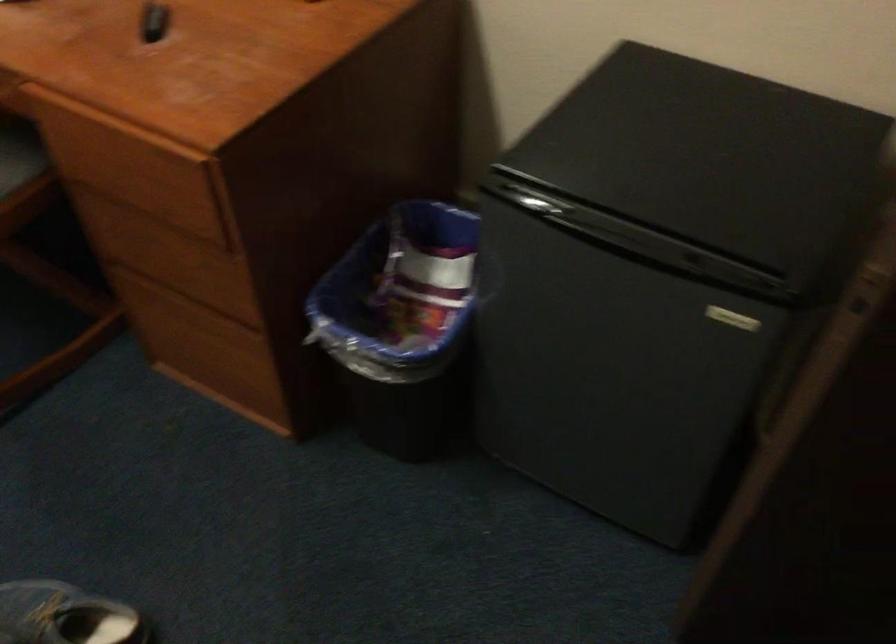
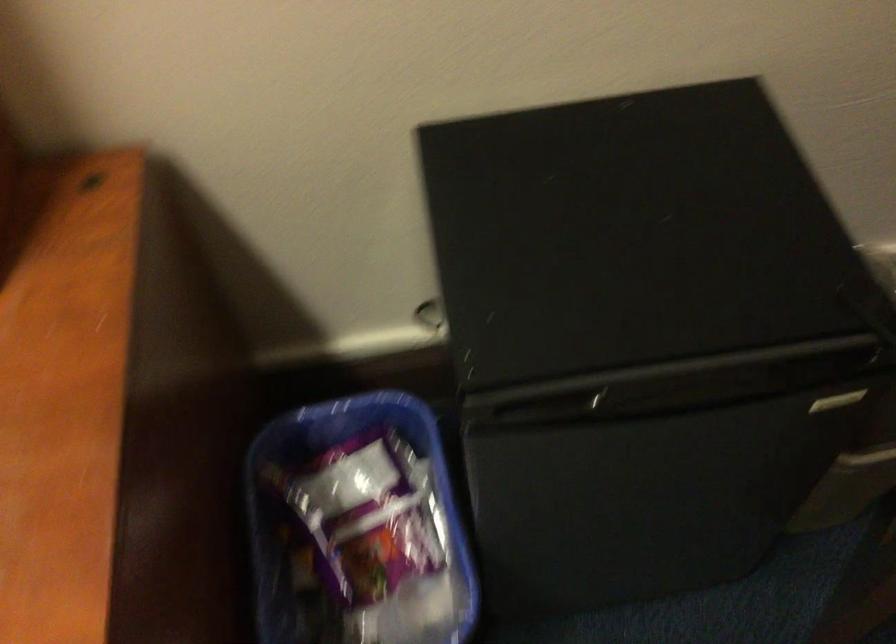
Question: The camera is either moving clockwise (left) or counter-clockwise (right) around the object. The first image is from the beginning of the video and the second image is from the end. Is the camera moving left or right when shooting the video?

Choices:
 (A) Left
 (B) Right

Answer: (A)